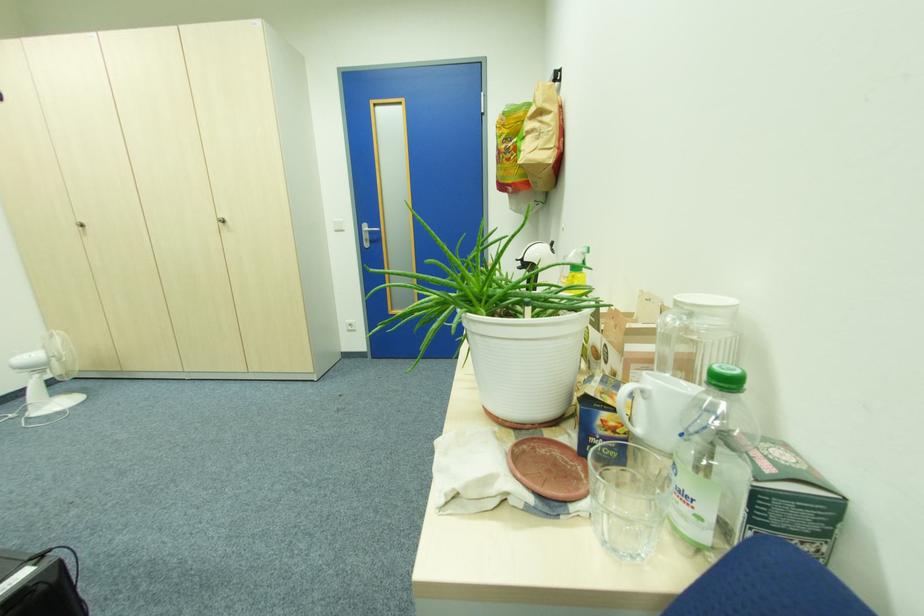
The location [1,1] corresponds to which object?

It refers to a clear drinking glass.